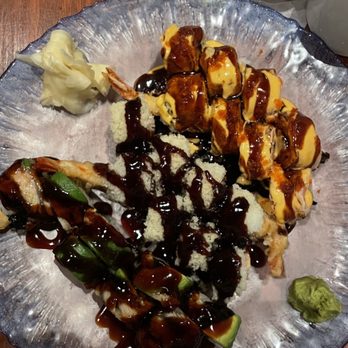
At what (x,y) coordinates should I click in order to perform the action: click on white dish. Please return your answer as a coordinate pair (x, y). Looking at the image, I should click on (321, 21).